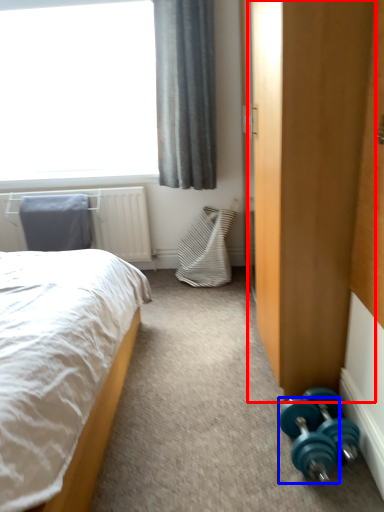
Question: Which of the following is the farthest to the observer, armoire (highlighted by a red box) or dumbbell (highlighted by a blue box)?

Choices:
 (A) armoire
 (B) dumbbell

Answer: (B)